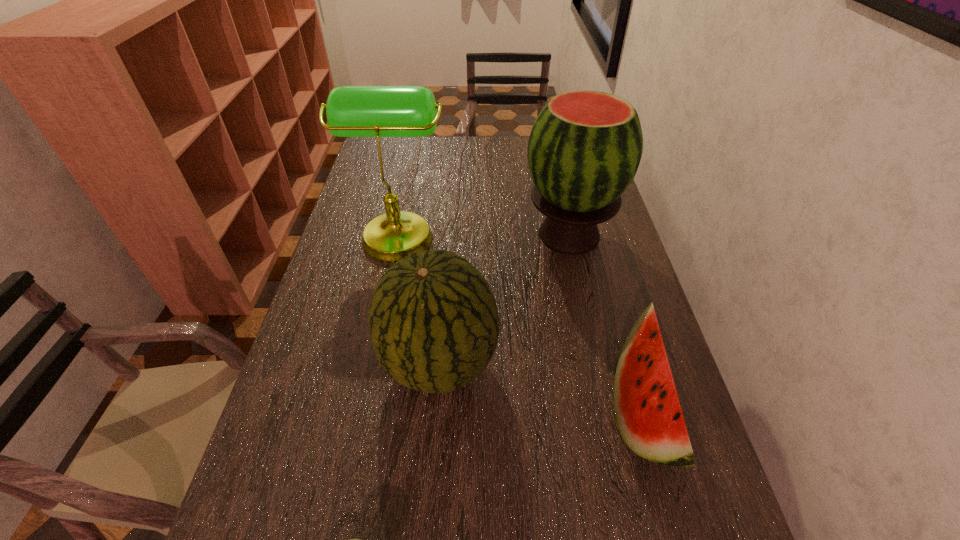
Where is `lamp`? The width and height of the screenshot is (960, 540). lamp is located at coordinates (352, 111).

Where is `the farthest watermelon`? the farthest watermelon is located at coordinates (585, 147).

Locate an element on the screen. This screenshot has height=540, width=960. the second shortest watermelon is located at coordinates (433, 320).

This screenshot has width=960, height=540. I want to click on the third tallest object, so click(433, 320).

Locate an element on the screen. the shortest watermelon is located at coordinates (647, 410).

Find the location of a particular element. Image resolution: width=960 pixels, height=540 pixels. vacant space located 0.340m on the desk next to the lamp is located at coordinates (557, 233).

Locate an element on the screen. This screenshot has width=960, height=540. vacant position located on the left of the tallest watermelon is located at coordinates (409, 234).

At what (x,y) coordinates should I click in order to perform the action: click on free space located on the right of the leftmost watermelon. Please return your answer as a coordinate pair (x, y). This screenshot has width=960, height=540. Looking at the image, I should click on (616, 364).

This screenshot has width=960, height=540. I want to click on vacant space positioned on the outer rind of the shortest watermelon, so click(x=550, y=411).

The width and height of the screenshot is (960, 540). In order to click on vacant area situated on the outer rind of the shortest watermelon in this screenshot , I will do `click(444, 411)`.